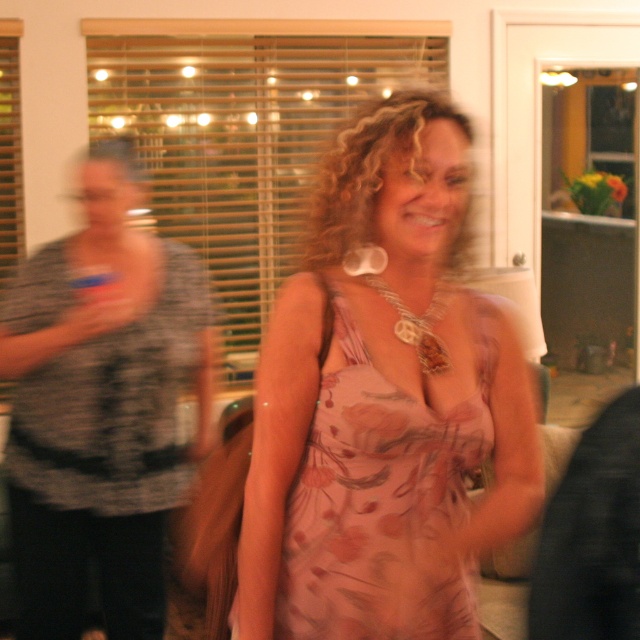
In the scene shown: You are at a party and see the floral silk dress at center and the silver metallic necklace at center. Which one is closer to you?

The floral silk dress at center is closer to you because it is in front of the silver metallic necklace at center.

You are at a party and want to take a photo of the floral silk dress at center and the silver metallic necklace at center. Which one should you focus on to ensure the bigger object is in clear view?

The floral silk dress at center is bigger than the silver metallic necklace at center, so you should focus on the floral silk dress at center to ensure the bigger object is in clear view.